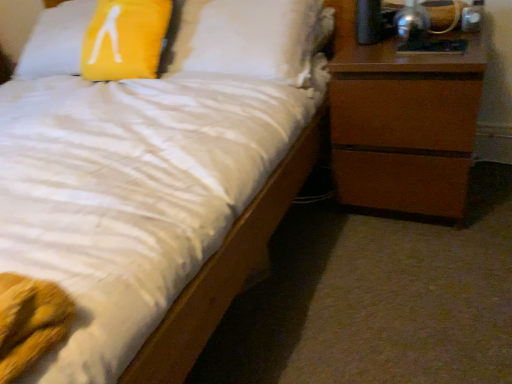
Locate an element on the screen. Image resolution: width=512 pixels, height=384 pixels. free space above brown wood chest of drawers at right (from a real-world perspective) is located at coordinates (415, 43).